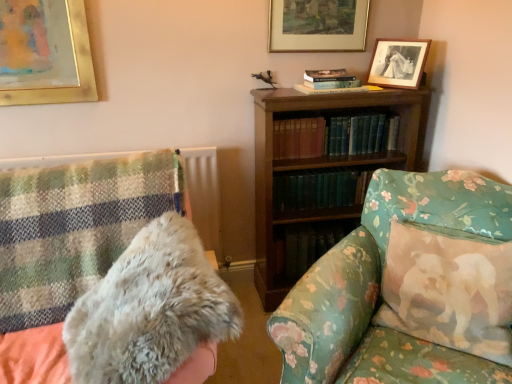
You are a GUI agent. You are given a task and a screenshot of the screen. Output one action in this format:
    pyautogui.click(x=<x>, y=<y>)
    Task: Click on the empty space that is ontop of green leather book at center, which ranks as the 2th book in bottom-to-top order (from a real-world perspective)
    The height and width of the screenshot is (384, 512).
    Given the screenshot: What is the action you would take?
    pyautogui.click(x=338, y=113)